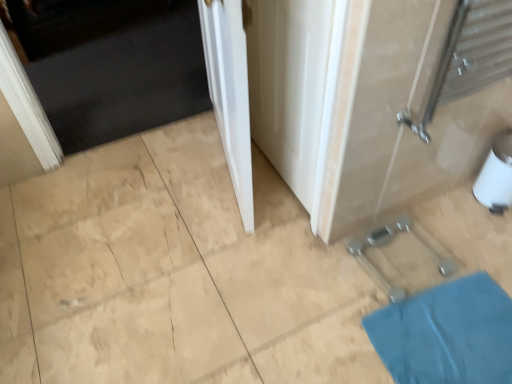
Question: Is white smooth door at center, the 1th door positioned from the front, at the back of white glossy door at upper left, acting as the second door starting from the front?

Choices:
 (A) no
 (B) yes

Answer: (A)

Question: From the image's perspective, is white glossy door at upper left, which ranks as the second door in right-to-left order, below white smooth door at center, the 1th door positioned from the front?

Choices:
 (A) yes
 (B) no

Answer: (B)

Question: Considering the relative sizes of white glossy door at upper left, acting as the second door starting from the front, and white smooth door at center, the 1th door positioned from the front, in the image provided, is white glossy door at upper left, acting as the second door starting from the front, thinner than white smooth door at center, the 1th door positioned from the front,?

Choices:
 (A) no
 (B) yes

Answer: (A)

Question: Does white glossy door at upper left, acting as the second door starting from the front, lie behind white smooth door at center, the 1th door positioned from the front?

Choices:
 (A) yes
 (B) no

Answer: (A)

Question: Is white smooth door at center, the 2th door in the back-to-front sequence, completely or partially inside white glossy door at upper left, which ranks as the second door in right-to-left order?

Choices:
 (A) yes
 (B) no

Answer: (B)

Question: Considering the relative positions of white smooth door at center, the 1th door positioned from the front, and blue fabric bath mat at lower right in the image provided, is white smooth door at center, the 1th door positioned from the front, to the left or to the right of blue fabric bath mat at lower right?

Choices:
 (A) right
 (B) left

Answer: (B)

Question: Is point (240, 201) positioned closer to the camera than point (499, 379)?

Choices:
 (A) closer
 (B) farther

Answer: (B)

Question: From a real-world perspective, is white smooth door at center, the 2th door in the back-to-front sequence, above or below blue fabric bath mat at lower right?

Choices:
 (A) below
 (B) above

Answer: (B)

Question: From the image's perspective, is white smooth door at center, the 2th door in the back-to-front sequence, located above or below blue fabric bath mat at lower right?

Choices:
 (A) below
 (B) above

Answer: (B)

Question: Is white glossy door at center taller or shorter than white glossy door at upper left, the first door viewed from the back?

Choices:
 (A) short
 (B) tall

Answer: (B)

Question: From the image's perspective, is white glossy door at center located above or below white glossy door at upper left, the first door viewed from the back?

Choices:
 (A) below
 (B) above

Answer: (A)

Question: In the image, is white glossy door at center on the left side or the right side of white glossy door at upper left, which is counted as the first door, starting from the left?

Choices:
 (A) right
 (B) left

Answer: (A)

Question: In the image, is white glossy door at center positioned in front of or behind white glossy door at upper left, acting as the second door starting from the front?

Choices:
 (A) front
 (B) behind

Answer: (A)

Question: From a real-world perspective, is white smooth door at center, which ranks as the 2th door in left-to-right order, above or below white glossy door at upper left, acting as the second door starting from the front?

Choices:
 (A) above
 (B) below

Answer: (A)

Question: Would you say white smooth door at center, which ranks as the 2th door in left-to-right order, is to the left or to the right of white glossy door at upper left, the first door viewed from the back, in the picture?

Choices:
 (A) right
 (B) left

Answer: (A)